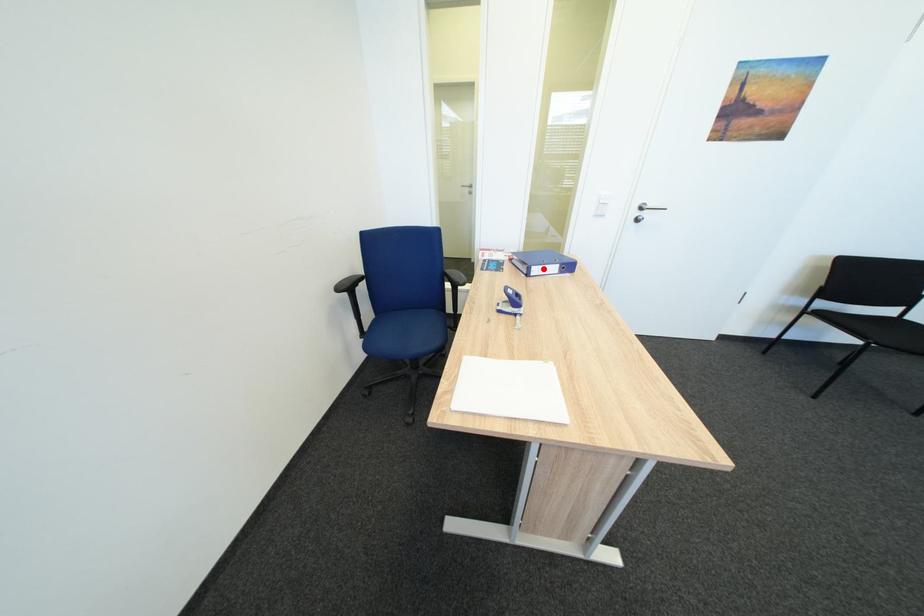
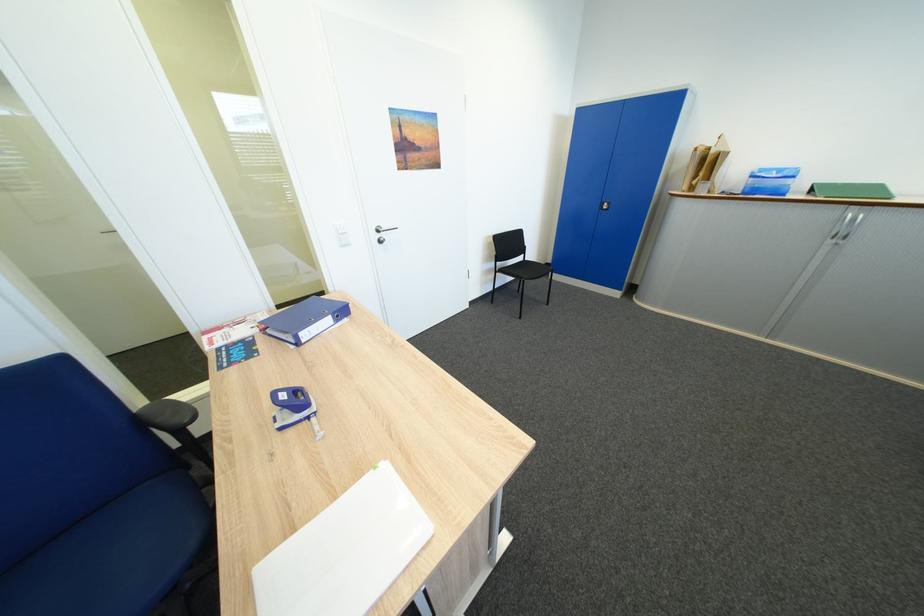
Find the pixel in the second image that matches the highlighted location in the first image.

(310, 334)